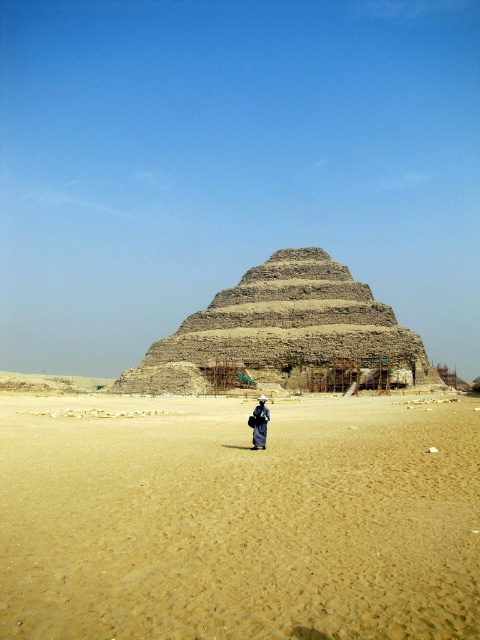
Is point (200, 531) less distant than point (255, 429)?

Yes, it is in front of point (255, 429).

Is brown sandy desert at center smaller than dark blue fabric at center?

Actually, brown sandy desert at center might be larger than dark blue fabric at center.

The image size is (480, 640). Find the location of `brown sandy desert at center`. brown sandy desert at center is located at coordinates (239, 518).

Is point (28, 552) farther from camera compared to point (308, 337)?

That is False.

You are a GUI agent. You are given a task and a screenshot of the screen. Output one action in this format:
    pyautogui.click(x=<x>, y=<y>)
    Task: Click on the brown sandy desert at center
    
    Given the screenshot: What is the action you would take?
    pyautogui.click(x=239, y=518)

Is point (250, 324) more distant than point (259, 403)?

Yes, it is behind point (259, 403).

Who is more distant from viewer, (239,380) or (259,436)?

Point (239,380)

This screenshot has height=640, width=480. I want to click on light brown stone steps at center, so click(x=286, y=336).